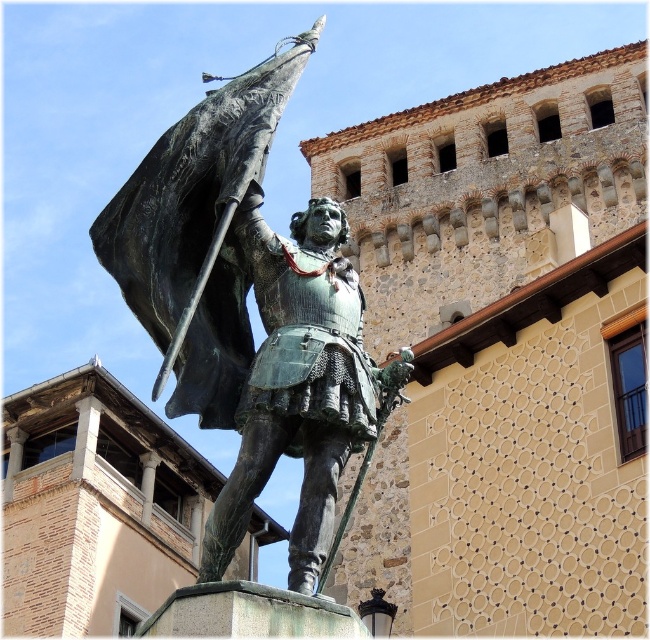
Does bronze statue at center have a smaller size compared to green patina armor at center?

No, bronze statue at center is not smaller than green patina armor at center.

Between bronze statue at center and green patina armor at center, which one appears on the left side from the viewer's perspective?

From the viewer's perspective, bronze statue at center appears more on the left side.

Find the location of a particular element. bronze statue at center is located at coordinates (247, 308).

Image resolution: width=650 pixels, height=640 pixels. Identify the location of bronze statue at center. (247, 308).